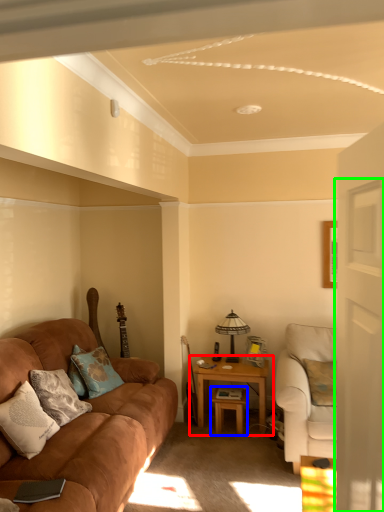
Question: Which object is positioned closest to table (highlighted by a red box)? Select from table (highlighted by a blue box) and glass door (highlighted by a green box).

Choices:
 (A) table
 (B) glass door

Answer: (A)